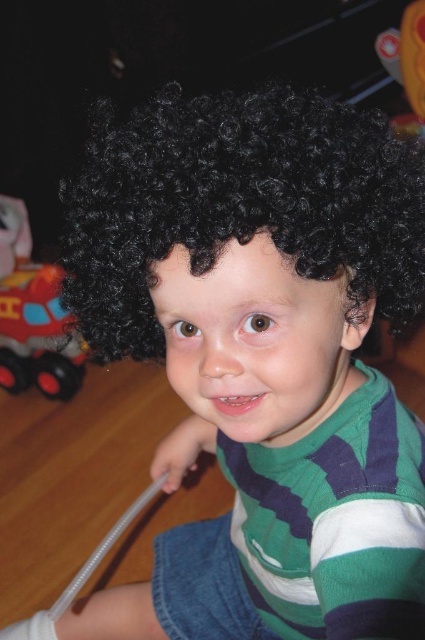
You are a parent trying to organize your childroom. You see the black curly wig at center and the rubberized red truck at lower left. Which object is positioned lower in the image?

The black curly wig at center is located below the rubberized red truck at lower left, so the black curly wig at center is positioned lower in the image.

You are a parent trying to place a 40 cm long toy on the floor between the two points marked as point [311,166]. Will the toy fit without overlapping either point?

The distance between the two points marked as point [311,166] is 38.35 centimeters. Since the toy is 40 cm long, it will not fit between them without overlapping either point.

In the scene shown: You are a photographer setting up for a photoshoot. You need to place a small prop between the black curly wig at center and the rubberized red truck at lower left. Where should you position it so it is equidistant from both objects?

The black curly wig at center is closer to the viewer than the rubberized red truck at lower left. To place the prop equidistant from both, position it halfway between them along the line connecting their positions, closer to the rubberized red truck at lower left since it is farther away.